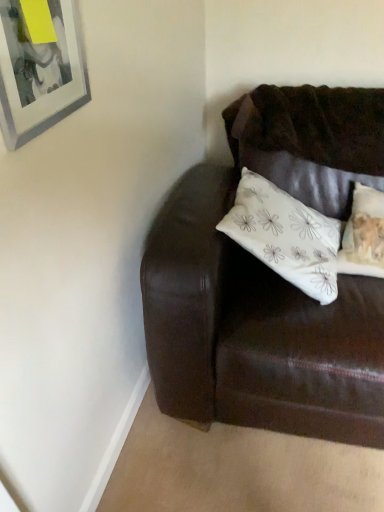
The width and height of the screenshot is (384, 512). Describe the element at coordinates (39, 67) in the screenshot. I see `silver-framed picture at upper left` at that location.

Identify the location of silver-framed picture at upper left. pos(39,67).

Consider the image. Measure the distance between point (29,134) and camera.

The depth of point (29,134) is 75.00 centimeters.

You are a GUI agent. You are given a task and a screenshot of the screen. Output one action in this format:
    pyautogui.click(x=<x>, y=<y>)
    Task: Click on the silver-framed picture at upper left
    The image size is (384, 512).
    Given the screenshot: What is the action you would take?
    pyautogui.click(x=39, y=67)